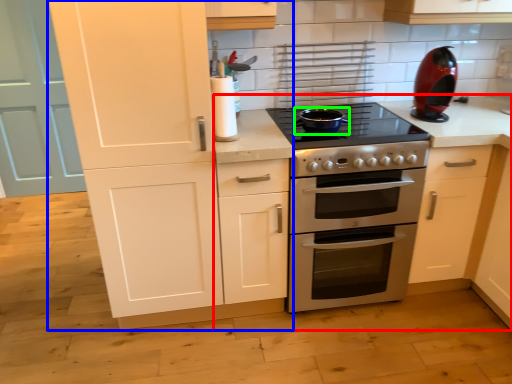
Question: Which object is positioned closest to countertop (highlighted by a red box)? Select from cabinetry (highlighted by a blue box) and appliance (highlighted by a green box).

Choices:
 (A) cabinetry
 (B) appliance

Answer: (B)